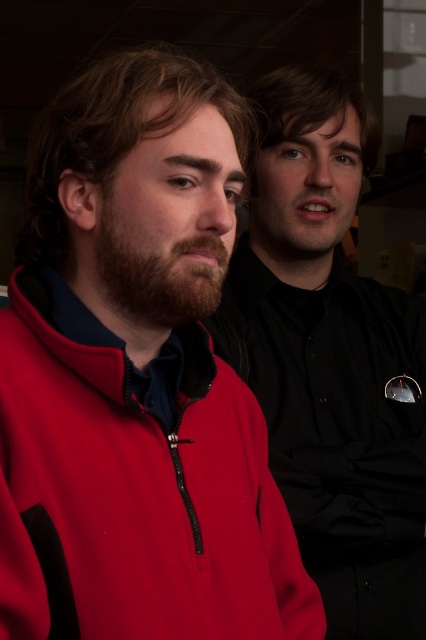
In the scene shown: Is matte fleece jacket at left further to the viewer compared to matte red jacket at left?

No, matte fleece jacket at left is in front of matte red jacket at left.

Can you confirm if matte fleece jacket at left is positioned below matte red jacket at left?

Indeed, matte fleece jacket at left is positioned under matte red jacket at left.

Is point (36, 307) farther from viewer compared to point (394, 460)?

No.

What are the coordinates of `matte fleece jacket at left` in the screenshot? It's located at (135, 490).